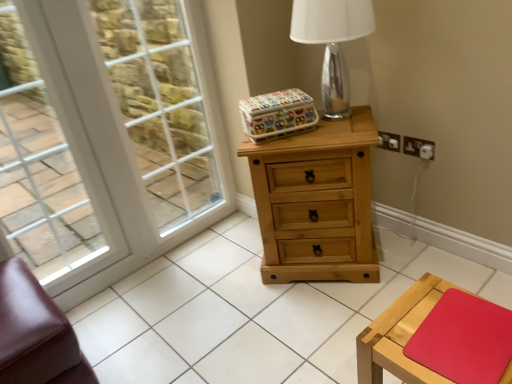
Question: From the image's perspective, is white glass window at left on natural wood tile at center?

Choices:
 (A) no
 (B) yes

Answer: (B)

Question: Considering the relative sizes of white glass window at left and natural wood tile at center in the image provided, is white glass window at left shorter than natural wood tile at center?

Choices:
 (A) yes
 (B) no

Answer: (B)

Question: From a real-world perspective, is white glass window at left on natural wood tile at center?

Choices:
 (A) yes
 (B) no

Answer: (A)

Question: From a real-world perspective, is white glass window at left under natural wood tile at center?

Choices:
 (A) yes
 (B) no

Answer: (B)

Question: Is white glass window at left further to the viewer compared to natural wood tile at center?

Choices:
 (A) no
 (B) yes

Answer: (B)

Question: Is white glass window at left at the left side of natural wood tile at center?

Choices:
 (A) yes
 (B) no

Answer: (A)

Question: Does white plastic electrical outlet at upper right, which is counted as the second electric outlet, starting from the left, have a larger size compared to brown leather ottoman at lower left?

Choices:
 (A) yes
 (B) no

Answer: (B)

Question: Is white plastic electrical outlet at upper right, which is counted as the second electric outlet, starting from the left, next to brown leather ottoman at lower left?

Choices:
 (A) yes
 (B) no

Answer: (B)

Question: Considering the relative positions of white plastic electrical outlet at upper right, which is counted as the 1th electric outlet, starting from the right, and brown leather ottoman at lower left in the image provided, is white plastic electrical outlet at upper right, which is counted as the 1th electric outlet, starting from the right, to the right of brown leather ottoman at lower left from the viewer's perspective?

Choices:
 (A) yes
 (B) no

Answer: (A)

Question: Is white plastic electrical outlet at upper right, which is counted as the 1th electric outlet, starting from the right, shorter than brown leather ottoman at lower left?

Choices:
 (A) no
 (B) yes

Answer: (B)

Question: Is white plastic electrical outlet at upper right, which is counted as the 1th electric outlet, starting from the right, positioned behind brown leather ottoman at lower left?

Choices:
 (A) yes
 (B) no

Answer: (A)

Question: Does white plastic electrical outlet at upper right, which is counted as the second electric outlet, starting from the left, turn towards brown leather ottoman at lower left?

Choices:
 (A) no
 (B) yes

Answer: (B)

Question: Can you confirm if transparent glass table lamp at upper center is positioned to the right of natural wood tile at center?

Choices:
 (A) no
 (B) yes

Answer: (B)